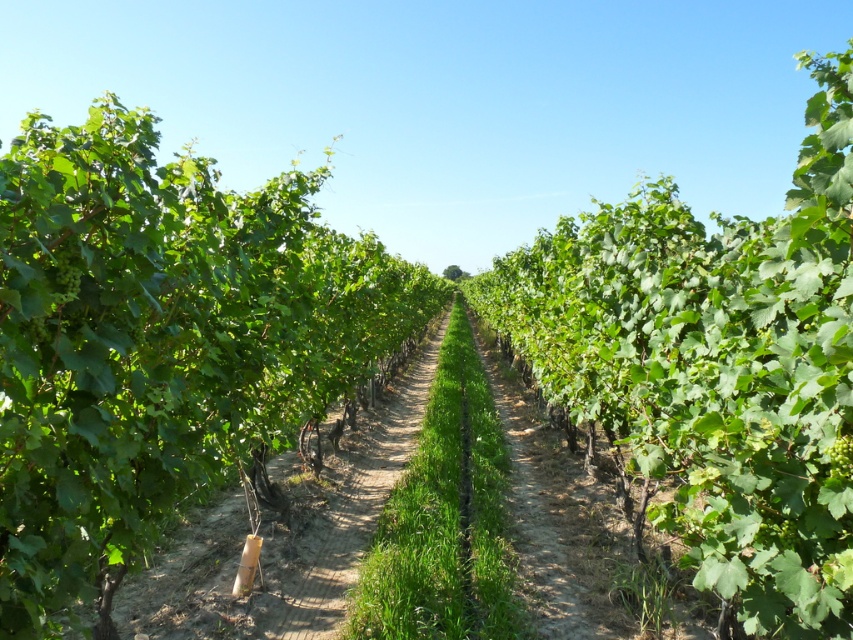
At what (x,y) coordinates should I click in order to perform the action: click on green grass at center. Please return your answer as a coordinate pair (x, y). This screenshot has width=853, height=640. Looking at the image, I should click on (352, 508).

Is point (402, 436) positioned before point (848, 448)?

No, (402, 436) is further to viewer.

This screenshot has height=640, width=853. I want to click on green grass at center, so click(352, 508).

Is point (73, 284) in front of point (837, 477)?

No, it is not.

Is point (67, 257) behind point (831, 465)?

Yes, point (67, 257) is behind point (831, 465).

I want to click on green matte grape at left, so click(67, 275).

Does green grass at center have a greater height compared to green matte grape at left?

Correct, green grass at center is much taller as green matte grape at left.

Which is behind, point (405, 422) or point (55, 273)?

The point (405, 422) is more distant.

Between point (299, 612) and point (67, 273), which one is positioned behind?

The point (299, 612) is behind.

Identify the location of green grass at center. (352, 508).